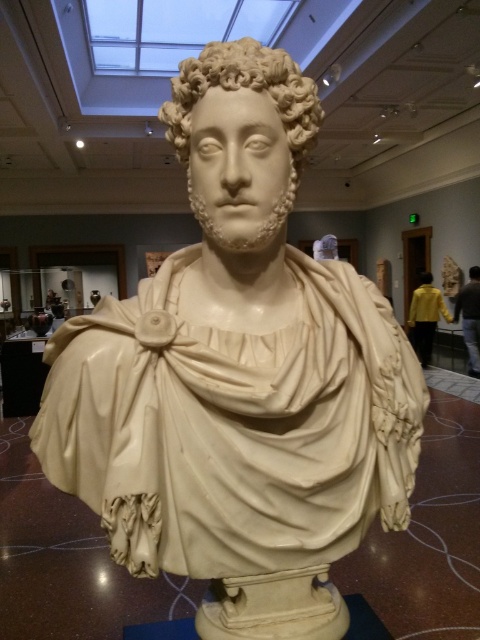
Question: Is white marble bust at center thinner than ivory sculpture at center?

Choices:
 (A) no
 (B) yes

Answer: (A)

Question: Is white marble bust at center positioned in front of ivory sculpture at center?

Choices:
 (A) yes
 (B) no

Answer: (A)

Question: Among these points, which one is nearest to the camera?

Choices:
 (A) (472, 266)
 (B) (204, 84)

Answer: (B)

Question: Which object is farther from the camera taking this photo?

Choices:
 (A) ivory sculpture at center
 (B) white marble bust at center

Answer: (A)

Question: Is white marble bust at center positioned in front of ivory sculpture at center?

Choices:
 (A) yes
 (B) no

Answer: (A)